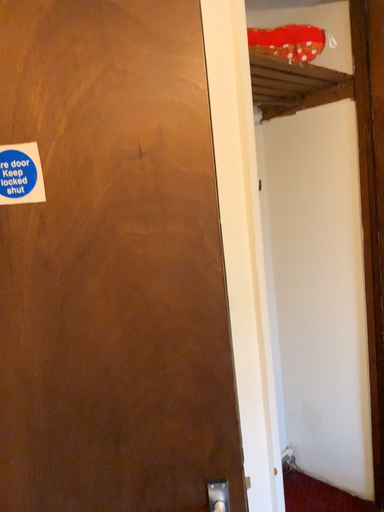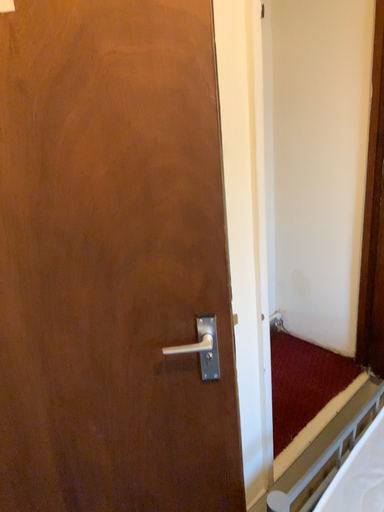
Question: Which way did the camera rotate in the video?

Choices:
 (A) rotated upward
 (B) rotated downward

Answer: (B)